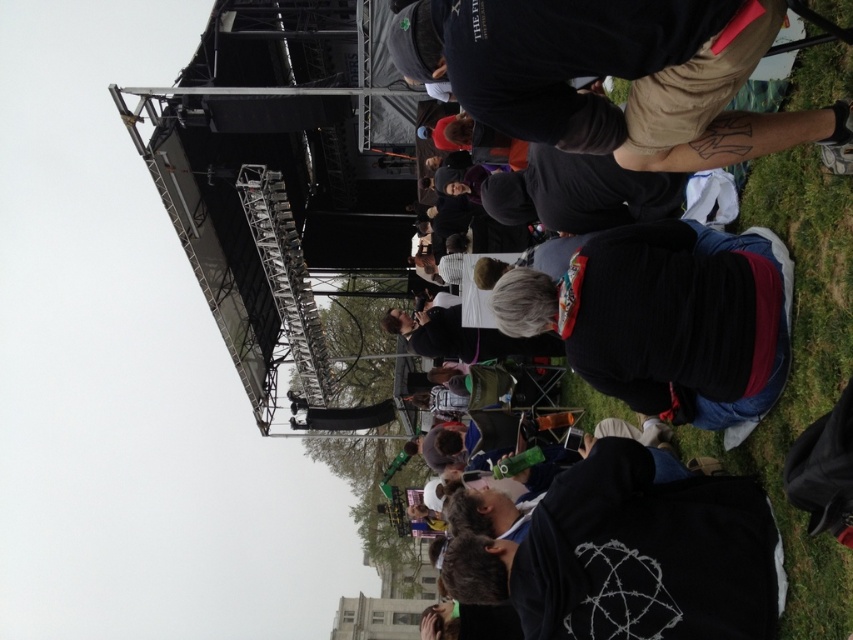
Which of these two, black matte jacket at lower right or black fabric at center, stands shorter?

With less height is black matte jacket at lower right.

Looking at this image, can you confirm if black matte jacket at lower right is positioned to the left of black fabric at center?

Answer: No, black matte jacket at lower right is not to the left of black fabric at center.

Is point (590, 465) in front of point (630, 102)?

No, it is not.

The width and height of the screenshot is (853, 640). In order to click on black matte jacket at lower right in this screenshot , I will do 631,556.

Between point (532, 122) and point (480, 4), which one is positioned behind?

Positioned behind is point (532, 122).

Who is more forward, (732, 44) or (416, 67)?

Point (732, 44) is more forward.

Where is `dark gray t-shirt at upper center`? The width and height of the screenshot is (853, 640). dark gray t-shirt at upper center is located at coordinates (611, 74).

This screenshot has height=640, width=853. Identify the location of dark gray t-shirt at upper center. (611, 74).

How much distance is there between black knit sweater at center and black fabric at center?

The distance of black knit sweater at center from black fabric at center is 8.49 meters.

Does black knit sweater at center have a lesser height compared to black fabric at center?

Yes.

This screenshot has height=640, width=853. I want to click on black knit sweater at center, so click(664, 320).